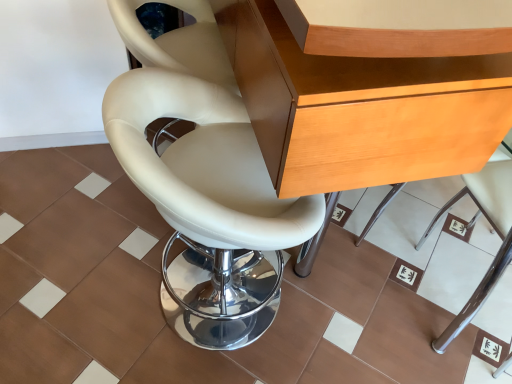
This screenshot has width=512, height=384. I want to click on free region on the left part of white leather chair at lower right, the second chair viewed from the left, so (376, 317).